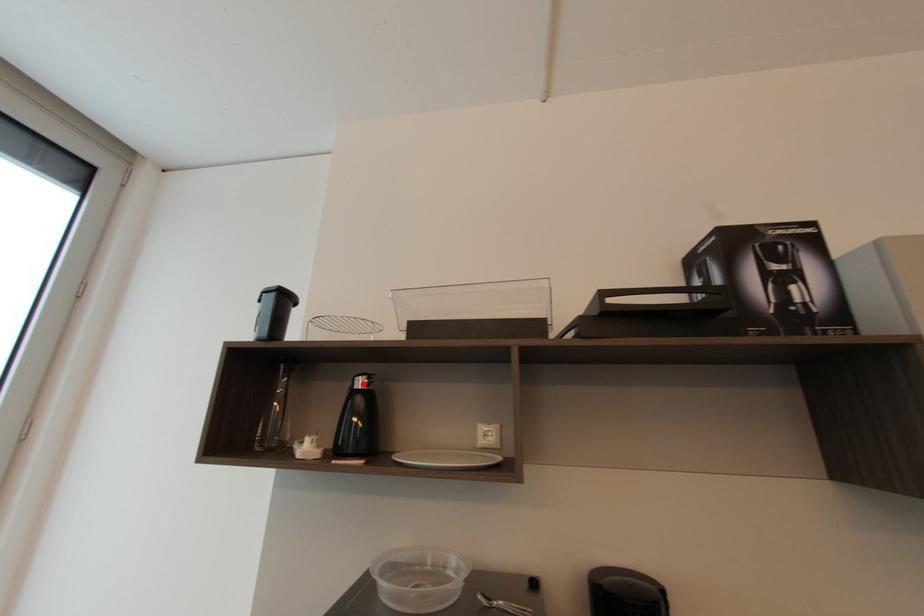
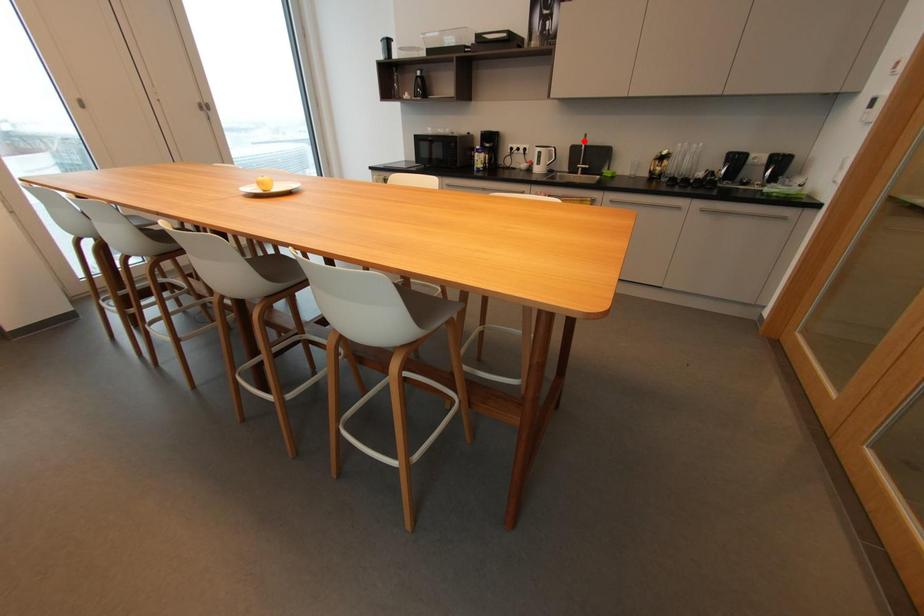
I am providing you with two images of the same scene from different viewpoints. A red point is marked on the first image and another point is marked on the second image. Is the red point in image1 aligned with the point shown in image2?

No